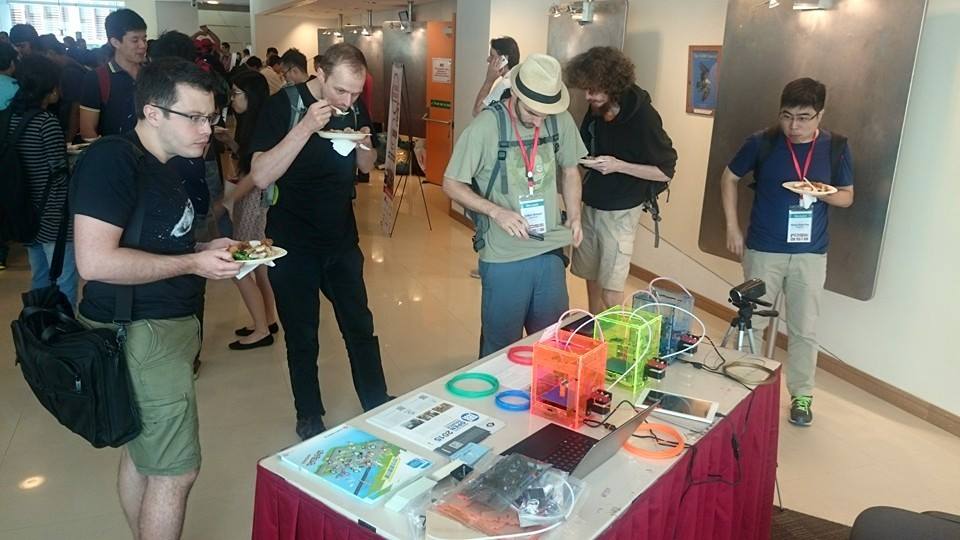
Where is `magenta tableskirt`? Image resolution: width=960 pixels, height=540 pixels. magenta tableskirt is located at coordinates (286, 519), (666, 525), (755, 484).